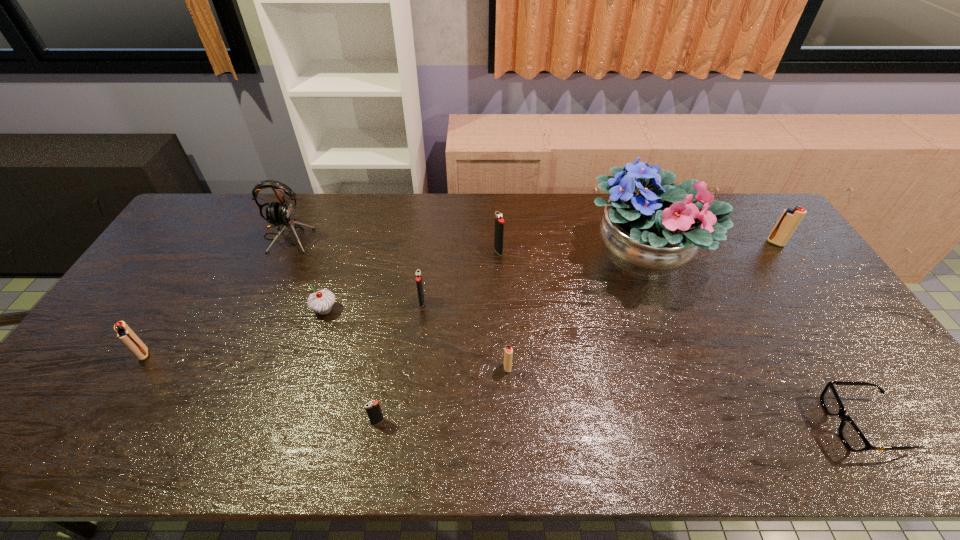
Where is `the third object from right to left`? The width and height of the screenshot is (960, 540). the third object from right to left is located at coordinates (649, 229).

I want to click on the tallest object, so click(649, 229).

Where is `the ninth shortest object`? the ninth shortest object is located at coordinates (282, 213).

You are a GUI agent. You are given a task and a screenshot of the screen. Output one action in this format:
    pyautogui.click(x=<x>, y=<y>)
    Task: Click on the black earphone
    The image size is (960, 540).
    Given the screenshot: What is the action you would take?
    pyautogui.click(x=282, y=213)

I want to click on the rightmost red igniter, so click(x=790, y=218).

Where is `the farthest red igniter`? This screenshot has height=540, width=960. the farthest red igniter is located at coordinates (790, 218).

Where is `the rightmost black igniter`? the rightmost black igniter is located at coordinates (499, 221).

Image resolution: width=960 pixels, height=540 pixels. Find the location of `the biggest black igniter`. the biggest black igniter is located at coordinates (499, 221).

The width and height of the screenshot is (960, 540). In order to click on the second black igniter from left to right in this screenshot , I will do `click(418, 273)`.

Locate an element on the screen. The width and height of the screenshot is (960, 540). the third igniter from left to right is located at coordinates (418, 273).